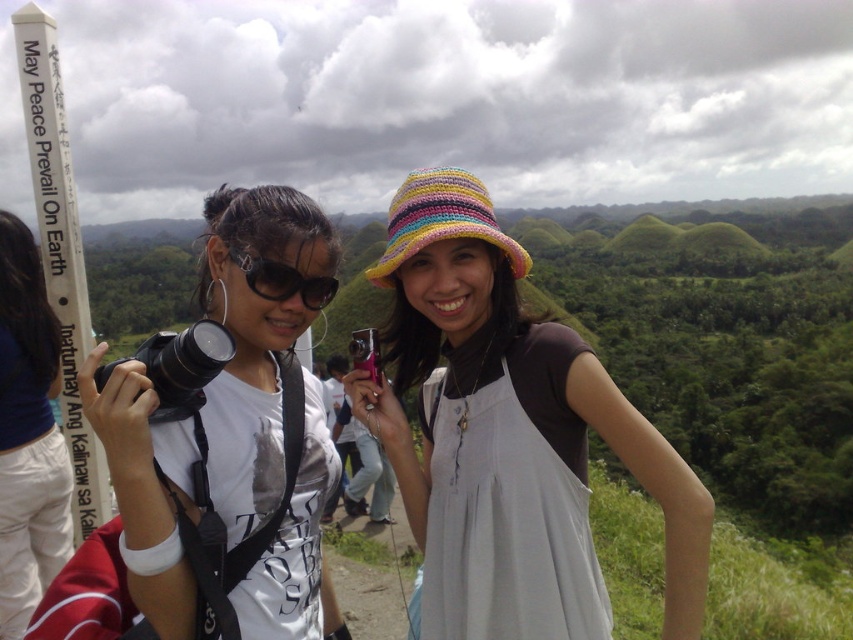
Does white fabric shirt at center appear on the right side of matte black sunglasses at center?

In fact, white fabric shirt at center is to the left of matte black sunglasses at center.

Based on the photo, between white fabric shirt at center and matte black sunglasses at center, which one is positioned higher?

matte black sunglasses at center is above.

You are a GUI agent. You are given a task and a screenshot of the screen. Output one action in this format:
    pyautogui.click(x=<x>, y=<y>)
    Task: Click on the white fabric shirt at center
    
    Given the screenshot: What is the action you would take?
    pyautogui.click(x=28, y=435)

Who is positioned more to the right, matte black sunglasses at center or black plastic camera at center?

Positioned to the right is matte black sunglasses at center.

Is matte black sunglasses at center to the left of black plastic camera at center from the viewer's perspective?

Incorrect, matte black sunglasses at center is not on the left side of black plastic camera at center.

Locate an element on the screen. This screenshot has height=640, width=853. matte black sunglasses at center is located at coordinates (283, 280).

Locate an element on the screen. matte black sunglasses at center is located at coordinates (283, 280).

Can you confirm if multicolored knitted hat at center is shorter than matte black sunglasses at center?

Incorrect, multicolored knitted hat at center's height does not fall short of matte black sunglasses at center's.

What do you see at coordinates (440, 220) in the screenshot? This screenshot has height=640, width=853. I see `multicolored knitted hat at center` at bounding box center [440, 220].

The height and width of the screenshot is (640, 853). In order to click on multicolored knitted hat at center in this screenshot , I will do `click(440, 220)`.